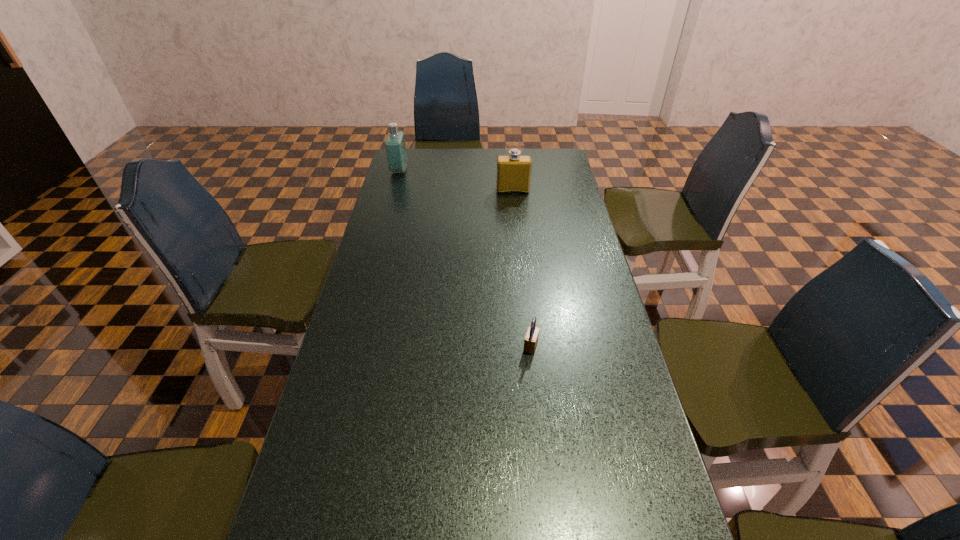
Find the location of `empty space that is in between the padlock and the farthest object`. empty space that is in between the padlock and the farthest object is located at coordinates point(465,258).

Where is `blank region between the nearest object and the left perfume`? The width and height of the screenshot is (960, 540). blank region between the nearest object and the left perfume is located at coordinates (465, 258).

At what (x,y) coordinates should I click in order to perform the action: click on vacant area between the farther perfume and the right perfume. Please return your answer as a coordinate pair (x, y). Looking at the image, I should click on (456, 180).

Image resolution: width=960 pixels, height=540 pixels. I want to click on unoccupied area between the shortest object and the nearer perfume, so click(521, 268).

I want to click on free spot between the second nearest object and the farthest object, so click(456, 180).

The image size is (960, 540). Find the location of `vacant area between the padlock and the left perfume`. vacant area between the padlock and the left perfume is located at coordinates (465, 258).

Locate an element on the screen. The height and width of the screenshot is (540, 960). blank region between the shortest object and the right perfume is located at coordinates (521, 268).

Identify which object is the second nearest to the shortest object. Please provide its 2D coordinates. Your answer should be formatted as a tuple, i.e. [(x, y)], where the tuple contains the x and y coordinates of a point satisfying the conditions above.

[(395, 145)]

Identify which object is the second closest to the second nearest object. Please provide its 2D coordinates. Your answer should be formatted as a tuple, i.e. [(x, y)], where the tuple contains the x and y coordinates of a point satisfying the conditions above.

[(531, 339)]

Identify the location of free space that satisfies the following two spatial constraints: 1. on the front label of the leftmost object; 2. on the left side of the padlock. The height and width of the screenshot is (540, 960). (350, 346).